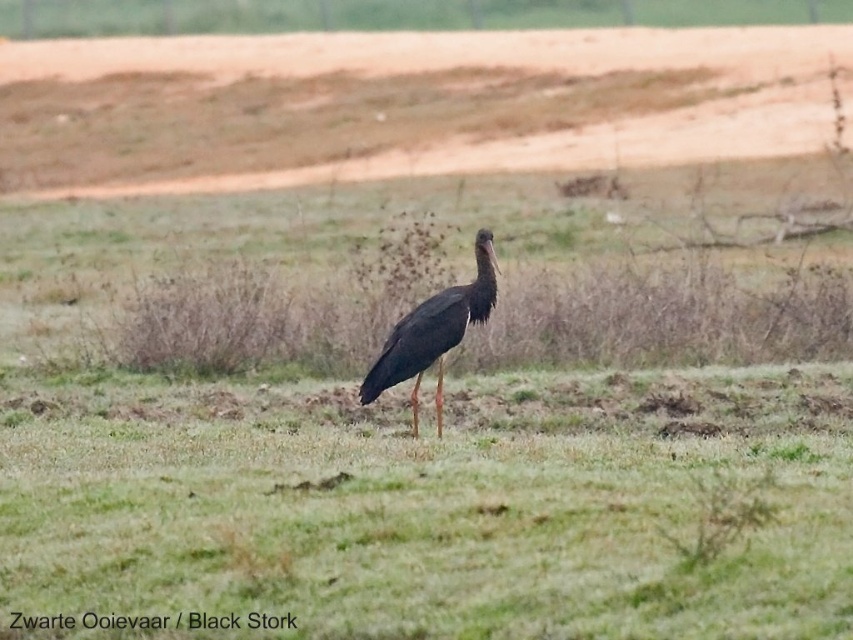
Question: Can you confirm if brown sandy dirt at upper center is positioned to the left of matte black stork at center?

Choices:
 (A) no
 (B) yes

Answer: (B)

Question: Is brown sandy dirt at upper center positioned behind matte black stork at center?

Choices:
 (A) no
 (B) yes

Answer: (B)

Question: Which of the following is the farthest from the observer?

Choices:
 (A) (453, 292)
 (B) (155, 42)

Answer: (B)

Question: Does brown sandy dirt at upper center have a smaller size compared to matte black stork at center?

Choices:
 (A) no
 (B) yes

Answer: (A)